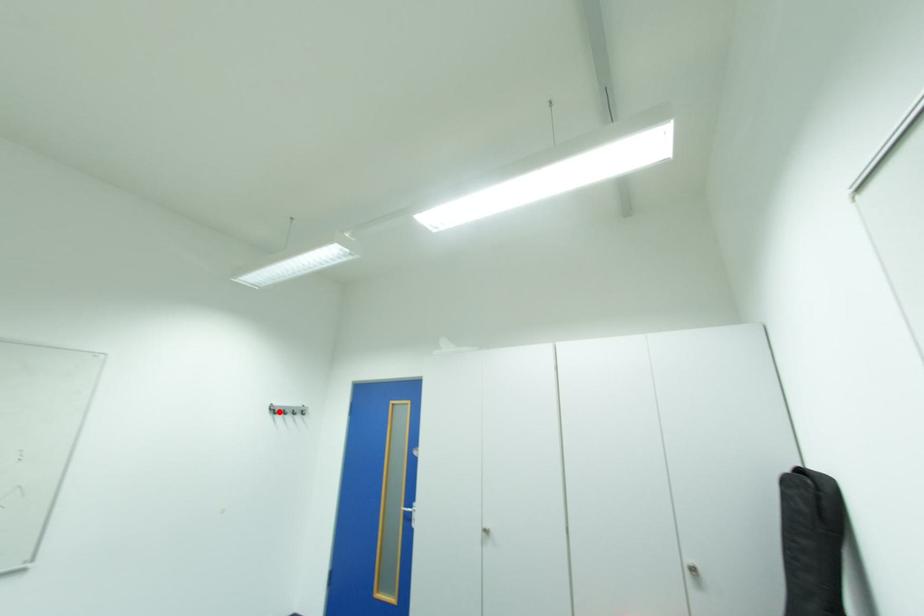
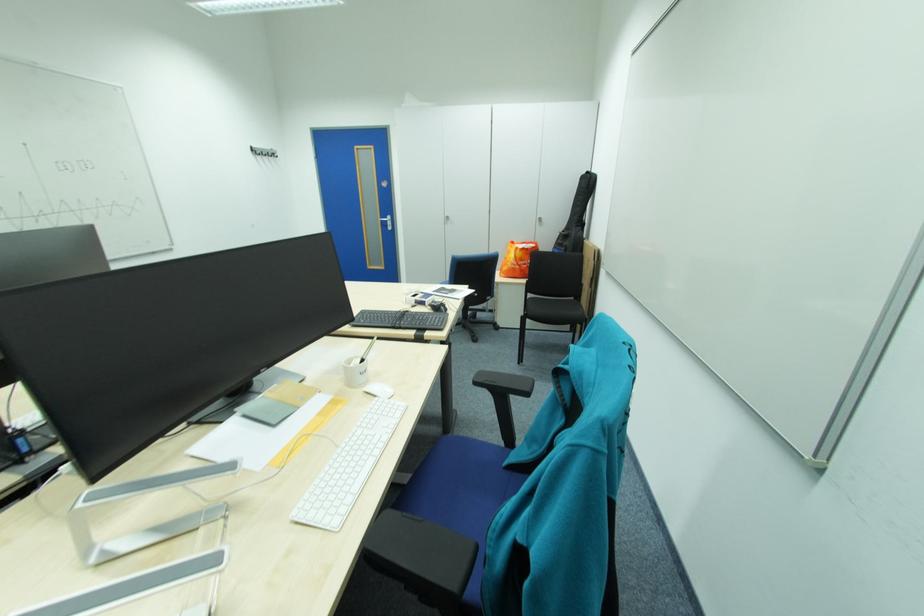
In the second image, find the point that corresponds to the highlighted location in the first image.

(262, 153)